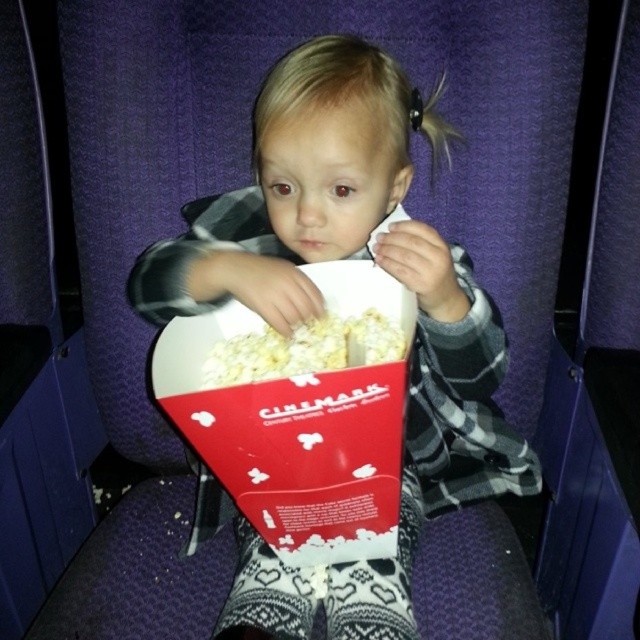
You are a moviegoer sitting in the cinema seat and want to grab some popcorn. Which type of popcorn, the white matte popcorn at center or the white fluffy popcorn at center, is easier to reach without moving your hands too much?

The white matte popcorn at center is closer to the viewer than the white fluffy popcorn at center, so it is easier to reach without moving your hands too much.

You are sitting in a cinema seat and want to reach for something in the image. Which of the two points, point (476, 316) or point (320, 323), is closer to you?

Point (476, 316) is closer to the camera than point (320, 323), so it is closer to you.